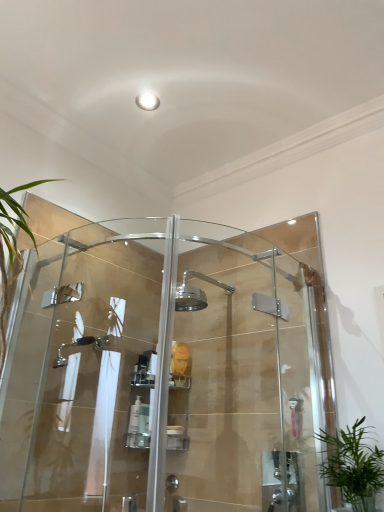
Question: Which direction should I rotate to look at white plastic pump bottle at center, marked as the first toiletry in a left-to-right arrangement?

Choices:
 (A) right
 (B) left

Answer: (B)

Question: Does white plastic pump bottle at center, marked as the first toiletry in a left-to-right arrangement, have a greater width compared to white plastic soap dish at center, which appears as the 1th toiletry when viewed from the right?

Choices:
 (A) yes
 (B) no

Answer: (B)

Question: Is white plastic pump bottle at center, marked as the first toiletry in a left-to-right arrangement, positioned with its back to white plastic soap dish at center, which appears as the 1th toiletry when viewed from the right?

Choices:
 (A) no
 (B) yes

Answer: (A)

Question: Can you confirm if white plastic pump bottle at center, marked as the first toiletry in a left-to-right arrangement, is thinner than white plastic soap dish at center, which appears as the 1th toiletry when viewed from the right?

Choices:
 (A) yes
 (B) no

Answer: (A)

Question: From a real-world perspective, is white plastic pump bottle at center, the 3th toiletry positioned from the right, physically below white plastic soap dish at center, which appears as the 1th toiletry when viewed from the right?

Choices:
 (A) no
 (B) yes

Answer: (A)

Question: Is white plastic pump bottle at center, the 3th toiletry positioned from the right, smaller than white plastic soap dish at center, which appears as the 1th toiletry when viewed from the right?

Choices:
 (A) no
 (B) yes

Answer: (B)

Question: Is white plastic pump bottle at center, the 3th toiletry positioned from the right, not near white plastic soap dish at center, which appears as the 1th toiletry when viewed from the right?

Choices:
 (A) no
 (B) yes

Answer: (A)

Question: Does clear glass shower door at center, positioned as the 2th screen door in left-to-right order, have a smaller size compared to clear plastic bottle at center, acting as the 2th toiletry starting from the right?

Choices:
 (A) no
 (B) yes

Answer: (A)

Question: Does clear glass shower door at center, positioned as the 2th screen door in left-to-right order, turn towards clear plastic bottle at center, acting as the 2th toiletry starting from the right?

Choices:
 (A) yes
 (B) no

Answer: (B)

Question: Can you confirm if clear glass shower door at center, positioned as the 2th screen door in left-to-right order, is taller than clear plastic bottle at center, which is the 2th toiletry from left to right?

Choices:
 (A) no
 (B) yes

Answer: (B)

Question: Would you say clear glass shower door at center, positioned as the 2th screen door in left-to-right order, contains clear plastic bottle at center, which is the 2th toiletry from left to right?

Choices:
 (A) no
 (B) yes

Answer: (A)

Question: Does clear glass shower door at center, positioned as the 2th screen door in left-to-right order, lie in front of clear plastic bottle at center, acting as the 2th toiletry starting from the right?

Choices:
 (A) no
 (B) yes

Answer: (B)

Question: Is clear plastic bottle at center, acting as the 2th toiletry starting from the right, at the back of clear glass shower door at center, the 1th screen door from the right?

Choices:
 (A) no
 (B) yes

Answer: (B)

Question: Is white plastic soap dish at center, the third toiletry when ordered from left to right, aimed at clear glass shower door at center, which is the 2th screen door from right to left?

Choices:
 (A) yes
 (B) no

Answer: (B)